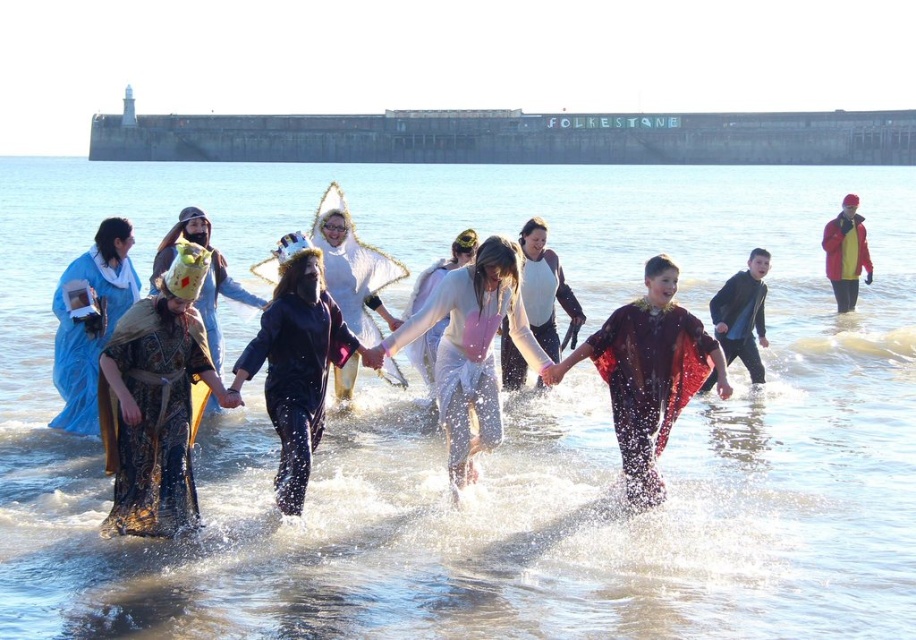
Does point (69, 376) come closer to viewer compared to point (750, 336)?

Yes, point (69, 376) is closer to viewer.

Is point (77, 433) positioned behind point (729, 285)?

No, it is in front of (729, 285).

At what (x,y) coordinates should I click in order to perform the action: click on blue fabric dress at left. Please return your answer as a coordinate pair (x, y). This screenshot has height=640, width=916. Looking at the image, I should click on (86, 333).

Does clear water at center have a lesser width compared to gold brocade cape at center?

No.

Does clear water at center appear under gold brocade cape at center?

Actually, clear water at center is above gold brocade cape at center.

Which is behind, point (90, 515) or point (175, 424)?

Point (90, 515)

Locate an element on the screen. clear water at center is located at coordinates (504, 426).

Can you confirm if black matte coat at center is positioned to the left of white satin dress at center?

Yes, black matte coat at center is to the left of white satin dress at center.

Which is in front, point (244, 364) or point (416, 344)?

Positioned in front is point (244, 364).

Where is `black matte coat at center`? The image size is (916, 640). black matte coat at center is located at coordinates (296, 380).